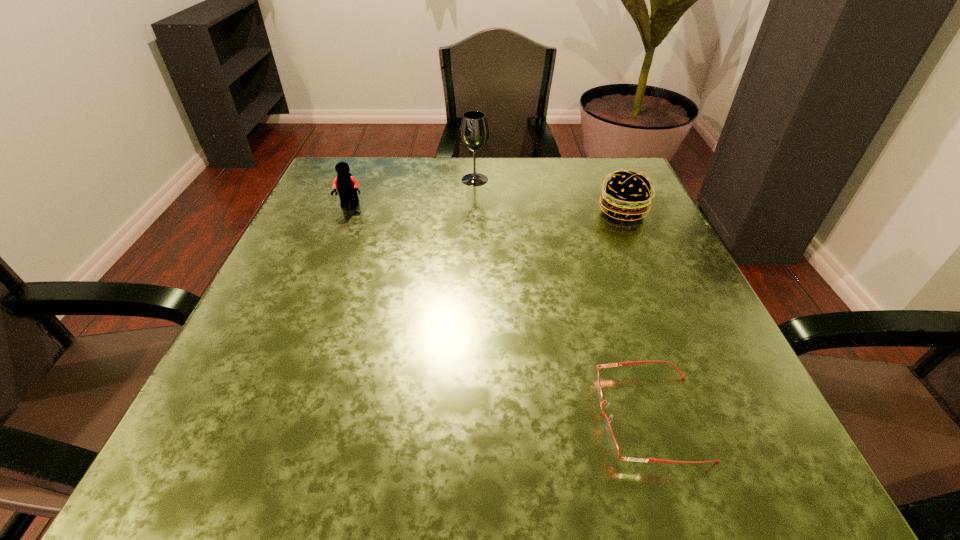
Where is `the tallest object`? the tallest object is located at coordinates (474, 132).

The width and height of the screenshot is (960, 540). What are the coordinates of `the third object from right to left` in the screenshot? It's located at (474, 132).

The width and height of the screenshot is (960, 540). What are the coordinates of `the leftmost object` in the screenshot? It's located at (347, 186).

The height and width of the screenshot is (540, 960). I want to click on patty, so click(x=628, y=194).

You are a GUI agent. You are given a task and a screenshot of the screen. Output one action in this format:
    pyautogui.click(x=<x>, y=<y>)
    Task: Click on the nearest object
    The width and height of the screenshot is (960, 540).
    Given the screenshot: What is the action you would take?
    pyautogui.click(x=612, y=441)

I want to click on the shortest object, so click(x=612, y=441).

Locate an element on the screen. This screenshot has width=960, height=540. free spot located 0.070m on the right of the wineglass is located at coordinates (517, 180).

Identify the location of vacant region located 0.120m on the front-facing side of the Lego. This screenshot has width=960, height=540. (335, 244).

The height and width of the screenshot is (540, 960). I want to click on vacant point located on the front of the patty, so click(x=642, y=256).

Locate an element on the screen. The width and height of the screenshot is (960, 540). free space located on the lenses of the nearest object is located at coordinates (479, 417).